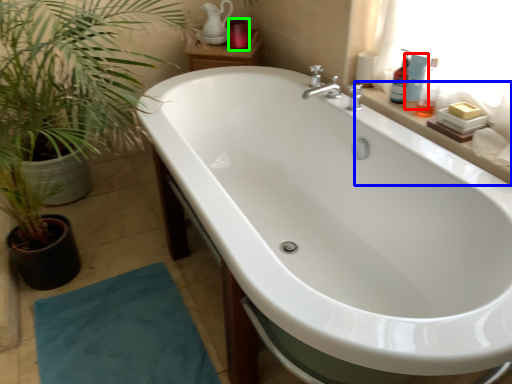
Question: Which object is the farthest from toiletry (highlighted by a red box)? Choose among these: counter top (highlighted by a blue box) or toiletry (highlighted by a green box).

Choices:
 (A) counter top
 (B) toiletry

Answer: (B)